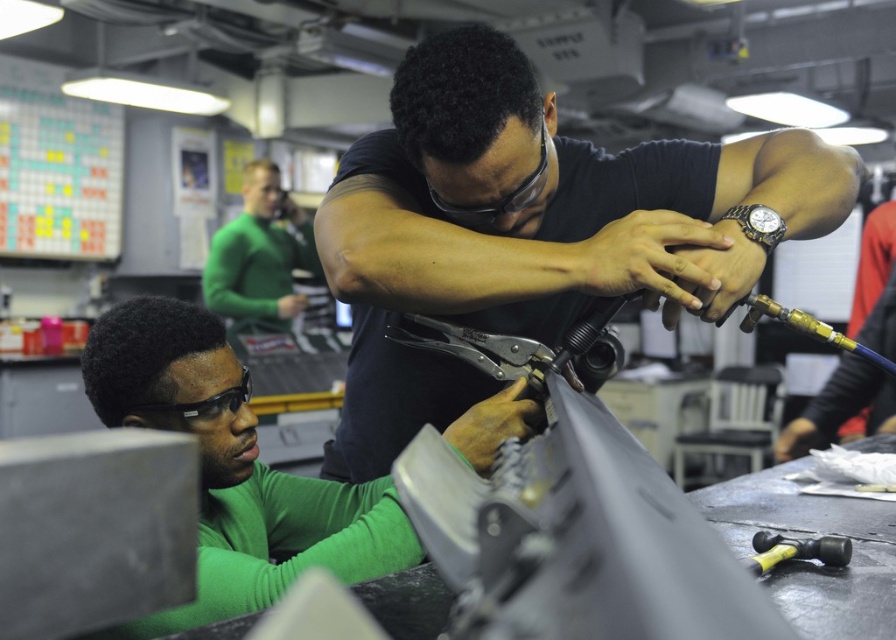
You are standing in the workshop scene described. You need to locate the green matte shirt at lower left. Where exactly is it positioned in terms of coordinates?

The green matte shirt at lower left is positioned at coordinates point (x=231, y=468).

You are standing in the workshop scene. There is a point at coordinates (231, 468). Which object from the scene does this point lie on?

The point at coordinates (231, 468) lies on the green matte shirt at lower left.